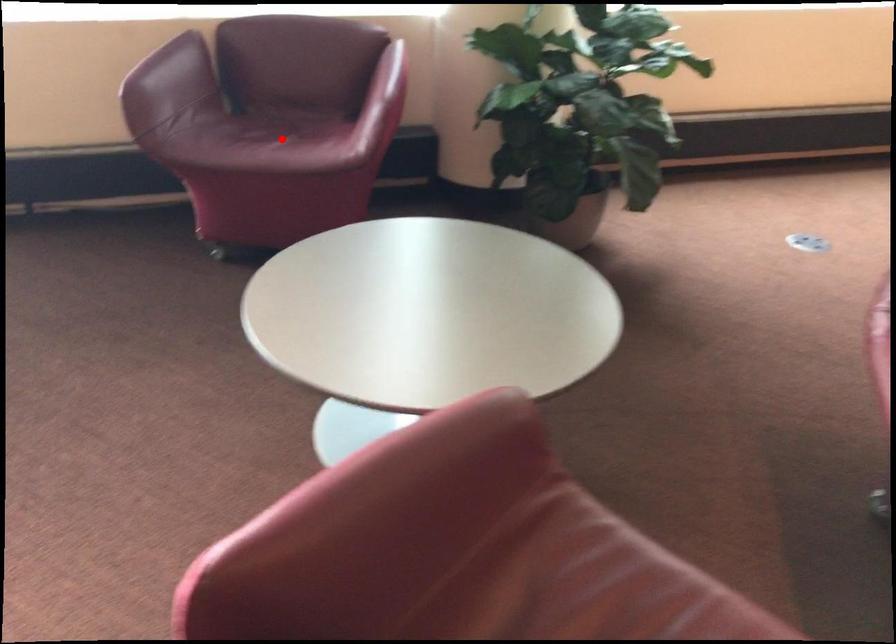
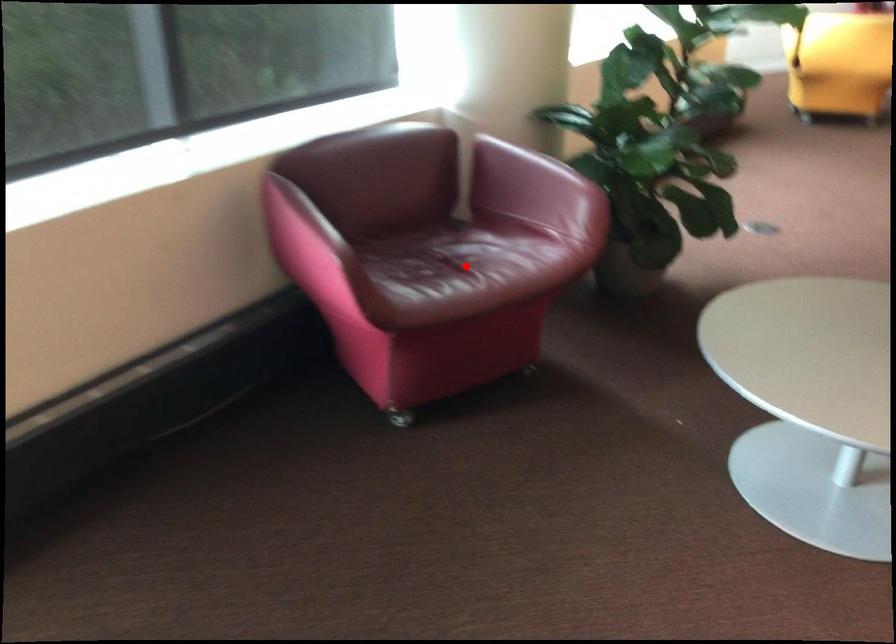
I am providing you with two images of the same scene from different viewpoints. A red point is marked on the first image and another point is marked on the second image. Do the highlighted points in image1 and image2 indicate the same real-world spot?

Yes